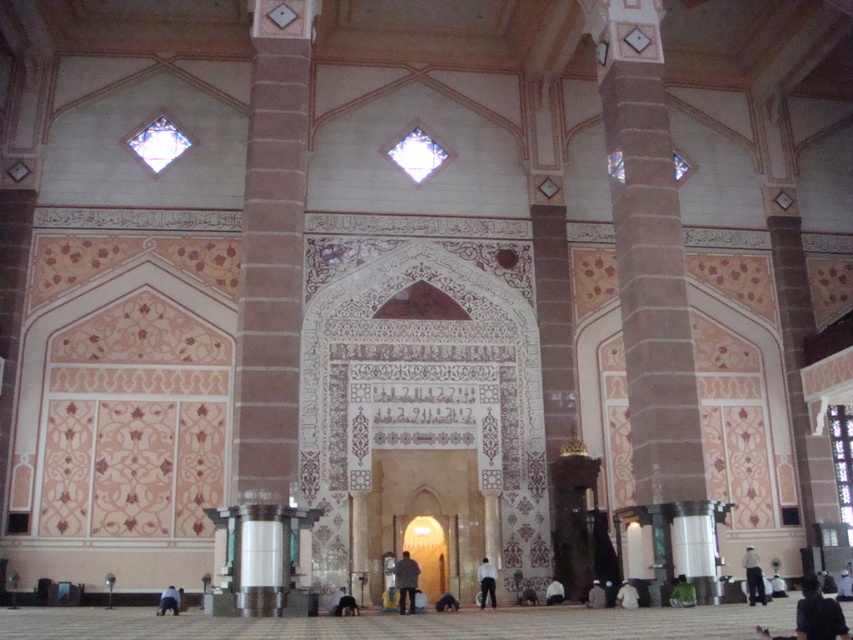
Between white matte shirt at center and white matte person at lower center, which one has less height?

With less height is white matte person at lower center.

Which is more to the right, white matte shirt at center or white matte person at lower center?

From the viewer's perspective, white matte person at lower center appears more on the right side.

Image resolution: width=853 pixels, height=640 pixels. Find the location of `white matte shirt at center`. white matte shirt at center is located at coordinates (486, 582).

At what (x,y) coordinates should I click in order to perform the action: click on white matte shirt at center. Please return your answer as a coordinate pair (x, y). Looking at the image, I should click on (486, 582).

Who is positioned more to the left, white cotton person at lower right or dark brown leather shoes at lower center?

dark brown leather shoes at lower center is more to the left.

How much distance is there between white cotton person at lower right and dark brown leather shoes at lower center?

white cotton person at lower right and dark brown leather shoes at lower center are 15.47 meters apart.

Is point (749, 572) positioned in front of point (450, 608)?

That is True.

Locate an element on the screen. Image resolution: width=853 pixels, height=640 pixels. white cotton person at lower right is located at coordinates (753, 577).

Which is more to the right, brown polished stone pillar at center or dark brown leather shoes at lower center?

Positioned to the right is dark brown leather shoes at lower center.

Is brown polished stone pillar at center wider than dark brown leather shoes at lower center?

Yes, brown polished stone pillar at center is wider than dark brown leather shoes at lower center.

What are the coordinates of `brown polished stone pillar at center` in the screenshot? It's located at (270, 324).